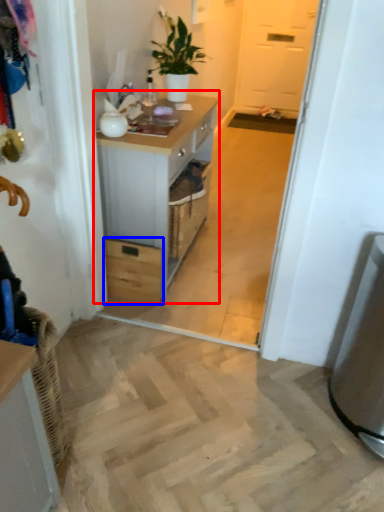
Question: Which of the following is the farthest to the observer, chest of drawers (highlighted by a red box) or drawer (highlighted by a blue box)?

Choices:
 (A) chest of drawers
 (B) drawer

Answer: (B)